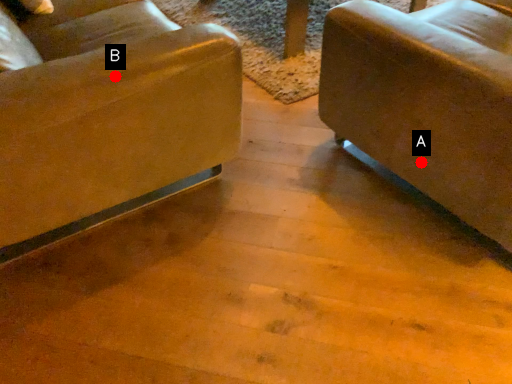
Question: Two points are circled on the image, labeled by A and B beside each circle. Among these points, which one is nearest to the camera?

Choices:
 (A) A is closer
 (B) B is closer

Answer: (B)